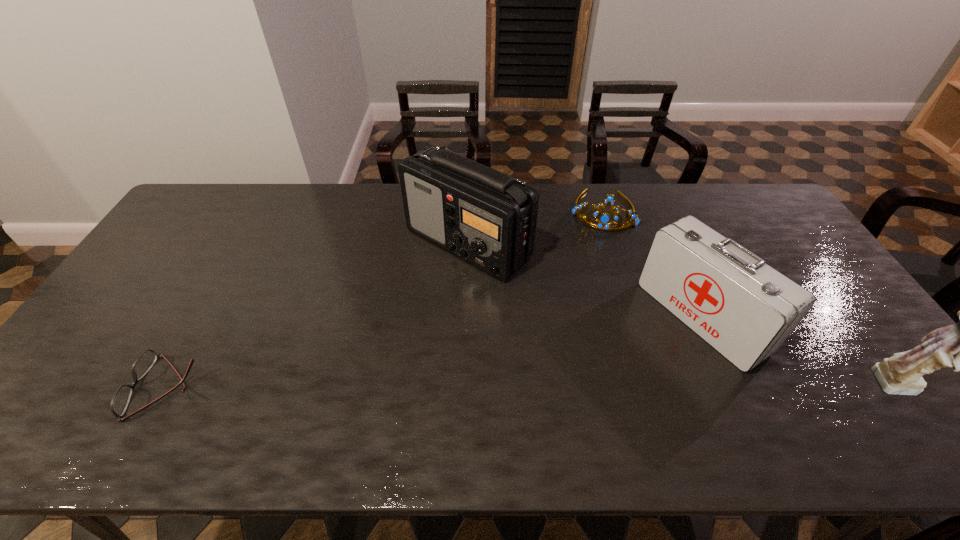
At what (x,y) coordinates should I click in order to perform the action: click on vacant space situated 0.070m on the front-facing side of the third tallest object. Please return your answer as a coordinate pair (x, y). The height and width of the screenshot is (540, 960). Looking at the image, I should click on point(648,358).

This screenshot has width=960, height=540. What are the coordinates of `vacant space located 0.270m on the front-facing side of the third tallest object` in the screenshot? It's located at (588, 396).

The width and height of the screenshot is (960, 540). In order to click on vacant space located 0.340m on the front-facing side of the tiara in this screenshot , I will do (585, 306).

The image size is (960, 540). In order to click on free space located 0.060m on the front-facing side of the tiara in this screenshot , I will do `click(597, 243)`.

The height and width of the screenshot is (540, 960). What are the coordinates of `blank space located 0.300m on the front-facing side of the tiara` in the screenshot? It's located at (587, 296).

Where is `free space located 0.270m on the front panel of the second object from left to right`? This screenshot has width=960, height=540. free space located 0.270m on the front panel of the second object from left to right is located at coordinates (435, 361).

The width and height of the screenshot is (960, 540). Find the location of `free space located 0.350m on the front panel of the second object from left to right`. free space located 0.350m on the front panel of the second object from left to right is located at coordinates (427, 389).

Where is `vacant space located 0.380m on the front panel of the second object from left to right`? The width and height of the screenshot is (960, 540). vacant space located 0.380m on the front panel of the second object from left to right is located at coordinates (424, 401).

Where is `tiara that is at the far edge`? tiara that is at the far edge is located at coordinates (604, 219).

Identify the location of radio receiver at the far edge. This screenshot has width=960, height=540. pos(487,218).